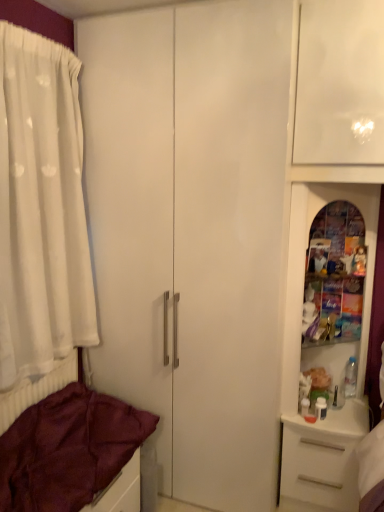
Question: From a real-world perspective, is white plastic drawer at lower right physically located above or below white sheer curtain at left?

Choices:
 (A) below
 (B) above

Answer: (A)

Question: From the image's perspective, is white plastic drawer at lower right above or below white sheer curtain at left?

Choices:
 (A) above
 (B) below

Answer: (B)

Question: Which object is positioned farthest from the maroon fabric bed at lower left?

Choices:
 (A) white plastic drawer at lower right
 (B) white sheer curtain at left

Answer: (A)

Question: Considering the real-world distances, which object is closest to the white sheer curtain at left?

Choices:
 (A) white plastic drawer at lower right
 (B) maroon fabric bed at lower left

Answer: (B)